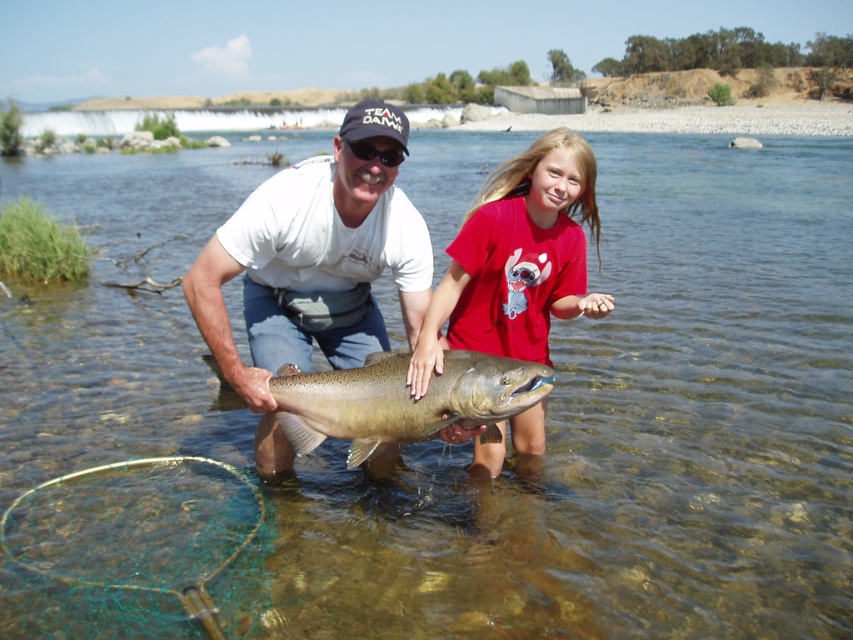
You are a photographer trying to capture the best angle of the scene. Since the matte white shirt at center and the shiny silver fish at center are both important subjects, which one should you focus on first to ensure it appears in the foreground of your photo?

The matte white shirt at center is located above the shiny silver fish at center, so focusing on the matte white shirt at center first will place it in the foreground as it is closer to the camera.